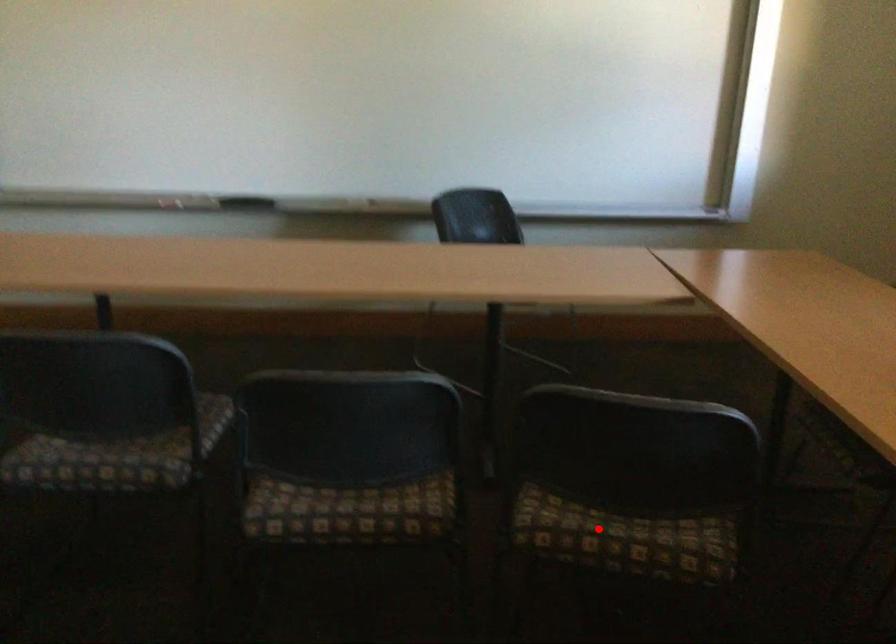
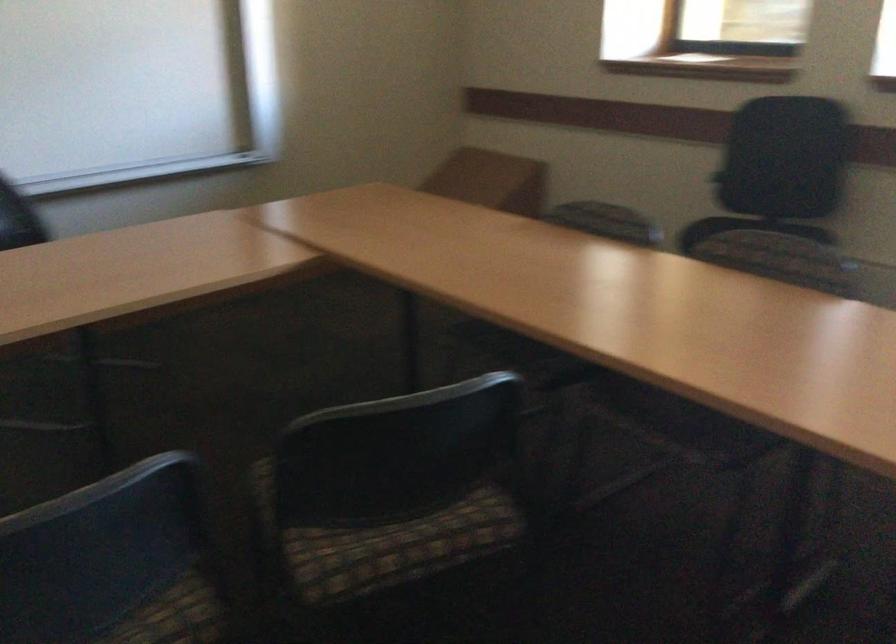
Find the pixel in the second image that matches the highlighted location in the first image.

(385, 543)